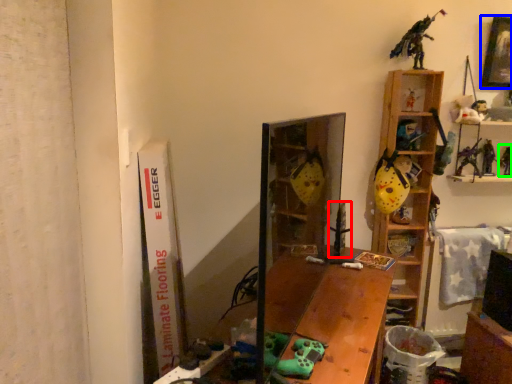
Question: Based on their relative distances, which object is farther from toy (highlighted by a red box)? Choose from picture frame (highlighted by a blue box) and toy (highlighted by a green box).

Choices:
 (A) picture frame
 (B) toy

Answer: (A)